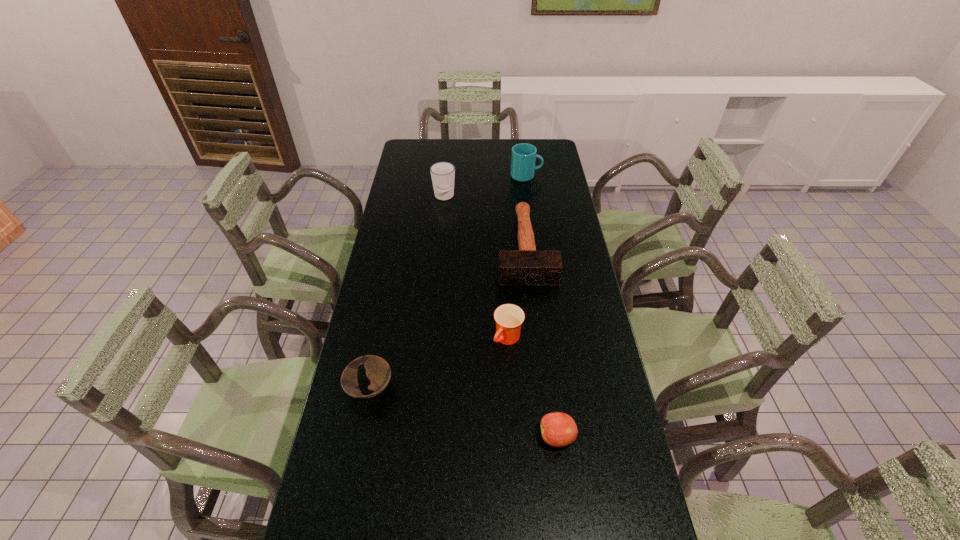
Find the location of a particular element. This screenshot has width=960, height=540. vacant space situated 0.100m on the handle side of the farthest cup is located at coordinates (564, 176).

Identify the location of vacant region located 0.240m with a handle on the side of the fifth nearest object. (440, 243).

Image resolution: width=960 pixels, height=540 pixels. I want to click on free space located on the left of the nearest cup, so click(449, 339).

Identify the location of vacant region located on the hammer head face of the third farthest object. The image size is (960, 540). (539, 364).

The width and height of the screenshot is (960, 540). I want to click on vacant region located on the left of the apple, so [400, 437].

Where is `vacant area situated on the right of the shortest object`? The width and height of the screenshot is (960, 540). vacant area situated on the right of the shortest object is located at coordinates (537, 388).

Where is `object at the left edge`? Image resolution: width=960 pixels, height=540 pixels. object at the left edge is located at coordinates (378, 371).

At what (x,y) coordinates should I click in order to perform the action: click on cup that is at the right edge. Please return your answer as a coordinate pair (x, y). This screenshot has width=960, height=540. Looking at the image, I should click on (523, 158).

Where is `mallet present at the right edge`? This screenshot has height=540, width=960. mallet present at the right edge is located at coordinates (527, 266).

Where is `apple that is at the right edge`? This screenshot has height=540, width=960. apple that is at the right edge is located at coordinates (558, 429).